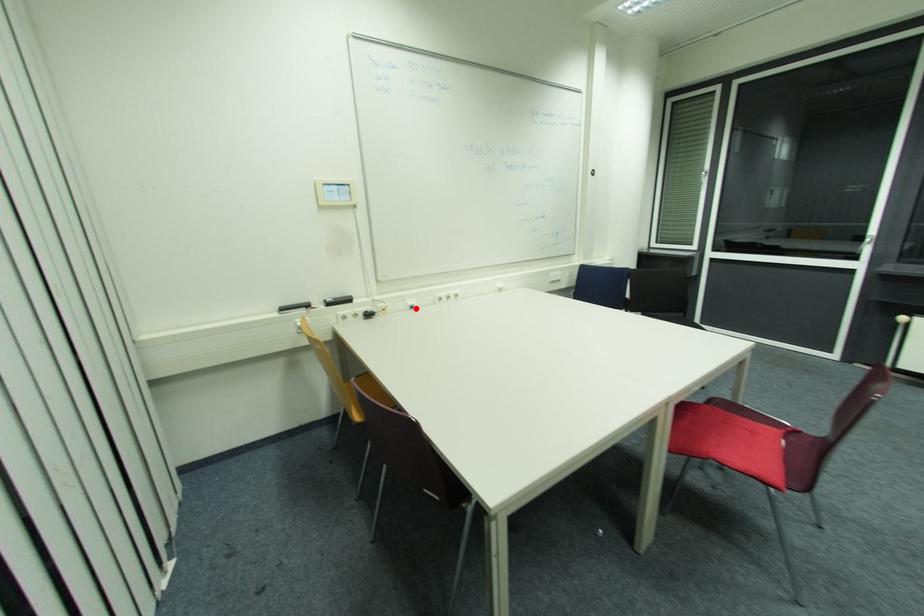
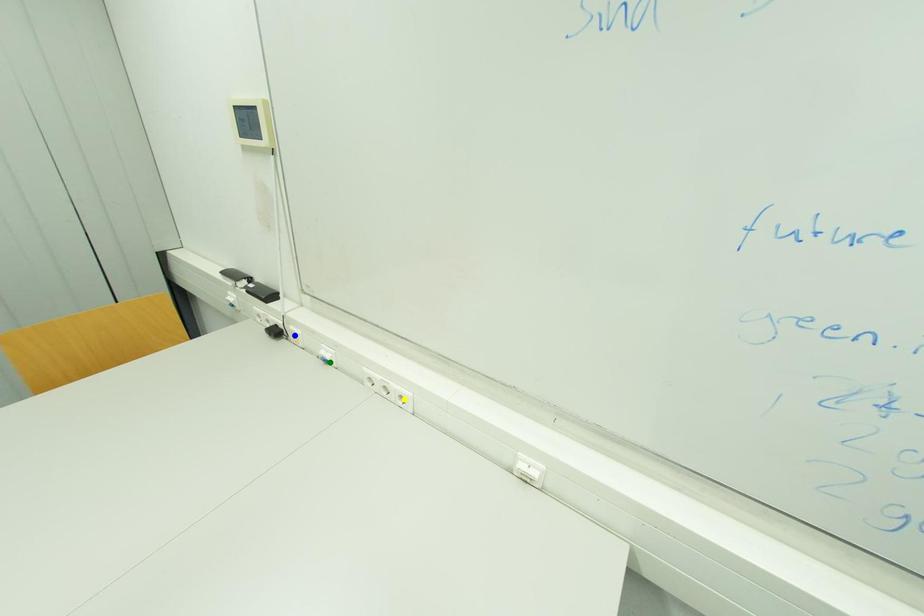
Question: I am providing you with two images of the same scene from different viewpoints. A red point is marked on the first image. You are given multiple points on the second image. Which point in image 2 represents the same 3d spot as the red point in image 1?

Choices:
 (A) blue point
 (B) green point
 (C) yellow point

Answer: (B)